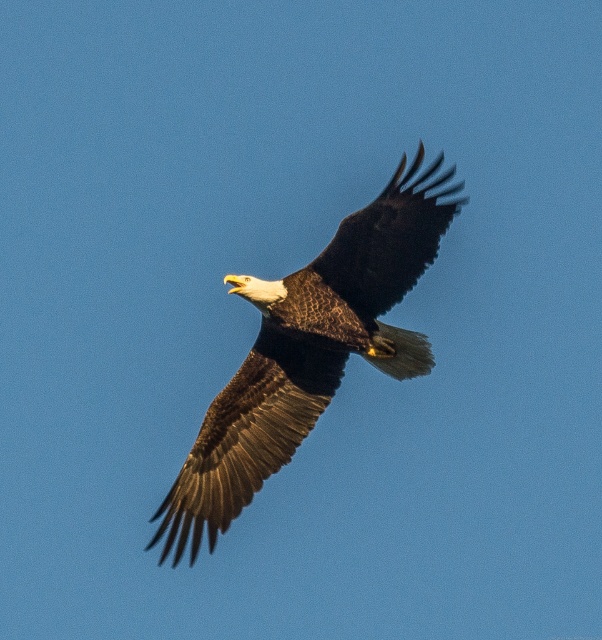
Question: Which point is farther to the camera?

Choices:
 (A) (393, 364)
 (B) (406, 253)

Answer: (A)

Question: Can you confirm if brown textured feathers at center is smaller than dark brown feathers at center?

Choices:
 (A) no
 (B) yes

Answer: (A)

Question: Among these objects, which one is farthest from the camera?

Choices:
 (A) brown textured feathers at center
 (B) dark brown feathers at center

Answer: (A)

Question: Which point is farther to the camera?

Choices:
 (A) dark brown feathers at center
 (B) brown textured feathers at center

Answer: (B)

Question: Can you confirm if brown textured feathers at center is thinner than dark brown feathers at center?

Choices:
 (A) no
 (B) yes

Answer: (A)

Question: Is brown textured feathers at center bigger than dark brown feathers at center?

Choices:
 (A) no
 (B) yes

Answer: (B)